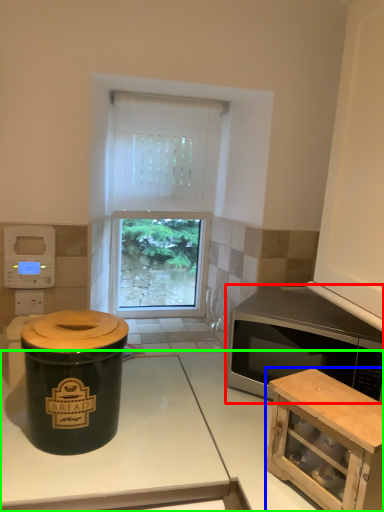
Question: Based on their relative distances, which object is nearer to microwave oven (highlighted by a red box)? Choose from cabinetry (highlighted by a blue box) and countertop (highlighted by a green box).

Choices:
 (A) cabinetry
 (B) countertop

Answer: (A)